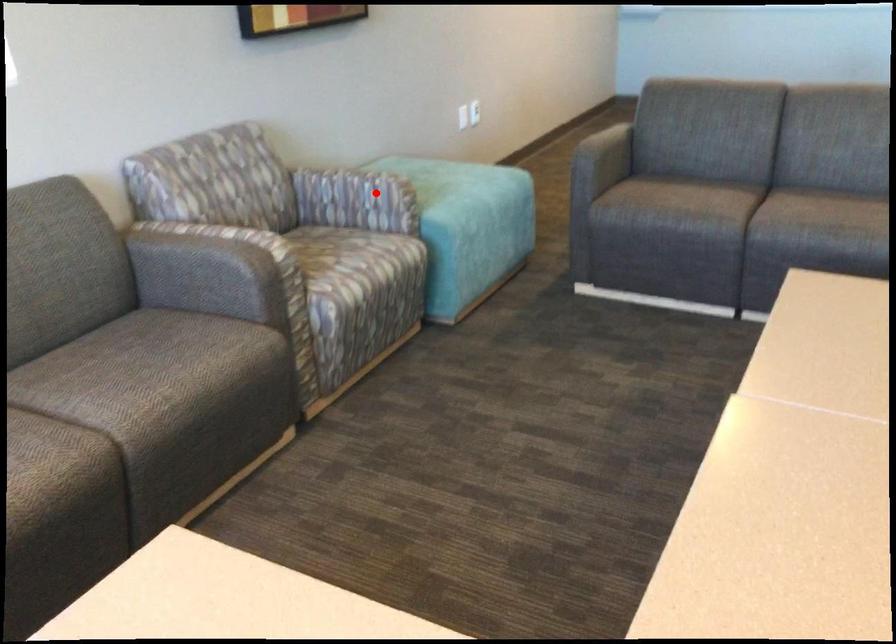
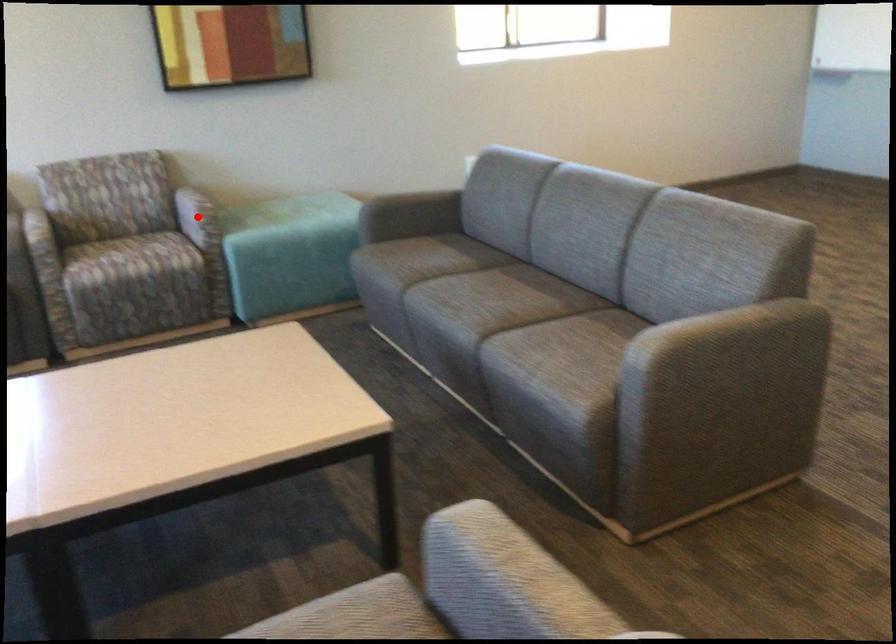
I am providing you with two images of the same scene from different viewpoints. A red point is marked on the first image and another point is marked on the second image. Is the marked point in image1 the same physical position as the marked point in image2?

Yes